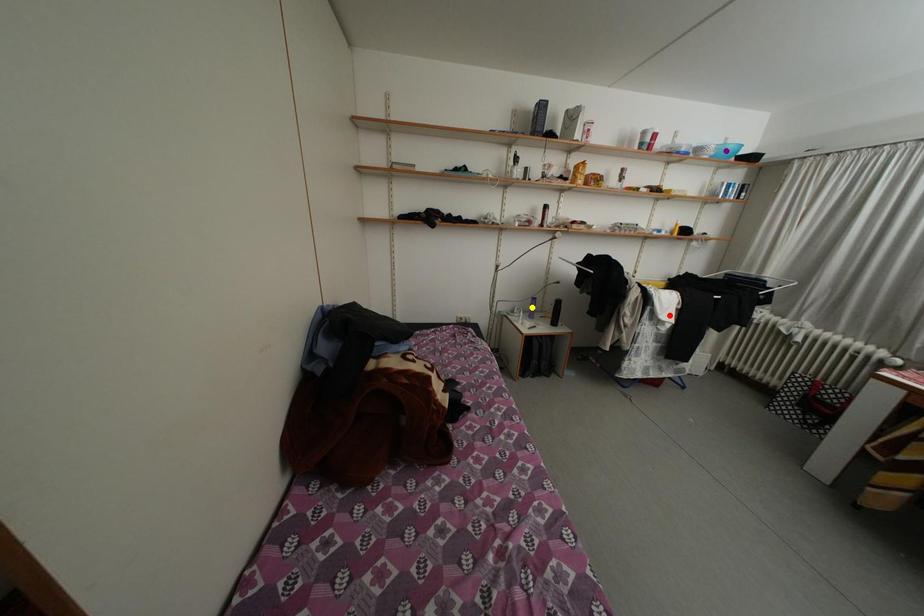
Order these from nearest to farthest:
A) red point
B) purple point
C) yellow point

red point
purple point
yellow point